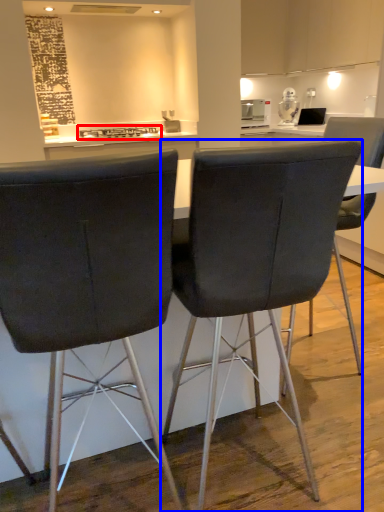
Question: Among these objects, which one is nearest to the camera, stove (highlighted by a red box) or chair (highlighted by a blue box)?

Choices:
 (A) stove
 (B) chair

Answer: (B)